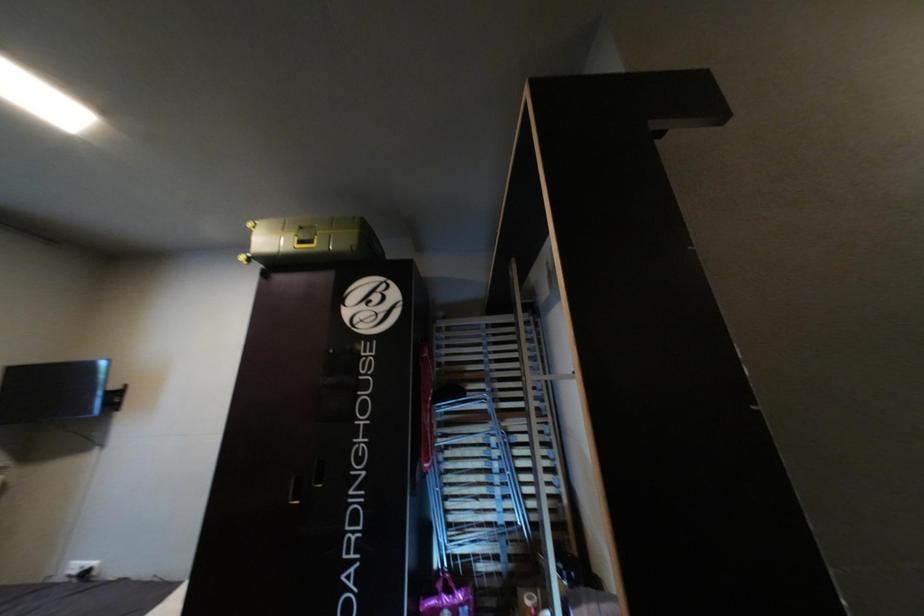
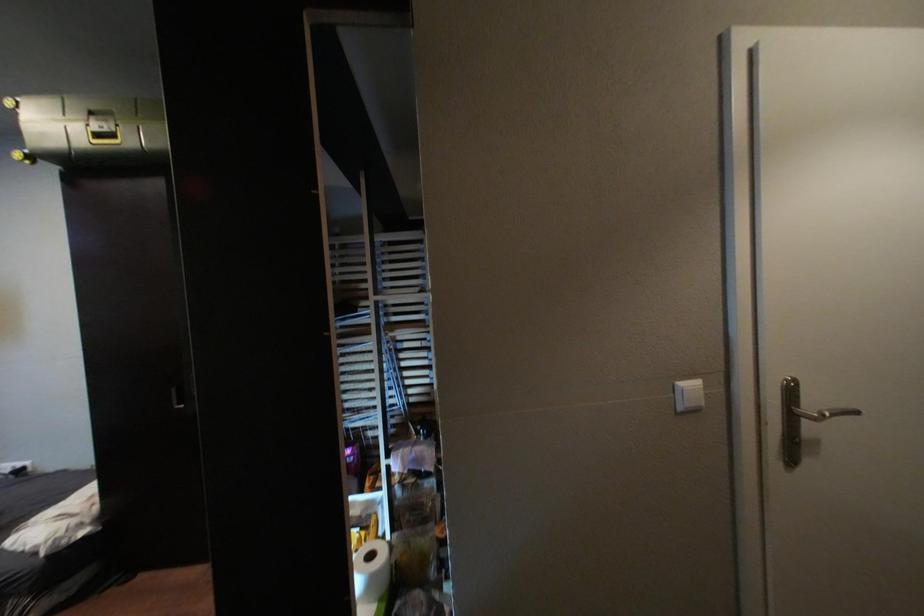
Question: The first image is from the beginning of the video and the second image is from the end. How did the camera likely rotate when shooting the video?

Choices:
 (A) Left
 (B) Right
 (C) Up
 (D) Down

Answer: (D)